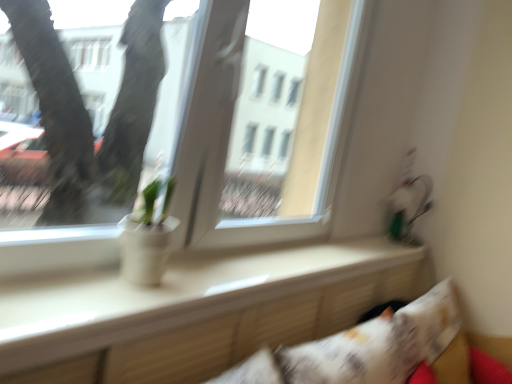
Image resolution: width=512 pixels, height=384 pixels. Describe the element at coordinates (196, 312) in the screenshot. I see `white glossy window sill at center` at that location.

Find the location of a particular element. This screenshot has width=512, height=384. white matte pot at center is located at coordinates (148, 237).

The height and width of the screenshot is (384, 512). I want to click on white printed pillow at lower right, so click(x=378, y=344).

Is white printed pillow at lower right not close to transparent glass window at center?

That's not correct — white printed pillow at lower right is a little close to transparent glass window at center.

Consider the image. Between white printed pillow at lower right and transparent glass window at center, which one has more height?

Standing taller between the two is transparent glass window at center.

From a real-world perspective, is white printed pillow at lower right on top of transparent glass window at center?

Incorrect, from a real-world perspective, white printed pillow at lower right is lower than transparent glass window at center.

Does white glossy window sill at center lie behind transparent glass window at center?

No, it is not.

Between white glossy window sill at center and transparent glass window at center, which one has more height?

Standing taller between the two is transparent glass window at center.

Considering the sizes of objects white glossy window sill at center and transparent glass window at center in the image provided, who is smaller, white glossy window sill at center or transparent glass window at center?

With smaller size is white glossy window sill at center.

Would you say white glossy window sill at center is to the left or to the right of transparent glass window at center in the picture?

In the image, white glossy window sill at center appears on the right side of transparent glass window at center.

Is transparent glass window at center closer to the viewer compared to white printed pillow at lower right?

No, it is behind white printed pillow at lower right.

Is transparent glass window at center located outside white printed pillow at lower right?

Absolutely, transparent glass window at center is external to white printed pillow at lower right.

From the image's perspective, which one is positioned higher, transparent glass window at center or white printed pillow at lower right?

transparent glass window at center.

Can you tell me how much transparent glass window at center and white printed pillow at lower right differ in facing direction?

The angle between the facing direction of transparent glass window at center and the facing direction of white printed pillow at lower right is 0.831 degrees.

From a real-world perspective, is white matte pot at center positioned under white printed pillow at lower right based on gravity?

Incorrect, from a real-world perspective, white matte pot at center is higher than white printed pillow at lower right.

Which of these two, white matte pot at center or white printed pillow at lower right, is smaller?

white matte pot at center.

Considering the positions of objects white matte pot at center and white printed pillow at lower right in the image provided, who is more to the right, white matte pot at center or white printed pillow at lower right?

From the viewer's perspective, white printed pillow at lower right appears more on the right side.

What are the coordinates of `pillow that is behind the white matte pot at center` in the screenshot? It's located at (378, 344).

The image size is (512, 384). In order to click on houseplant that appears in front of the transparent glass window at center in this screenshot , I will do `click(148, 237)`.

Does white matte pot at center turn towards transparent glass window at center?

No.

Would you say transparent glass window at center is part of white matte pot at center's contents?

Definitely not — transparent glass window at center is not inside white matte pot at center.

Is white matte pot at center bigger than transparent glass window at center?

Actually, white matte pot at center might be smaller than transparent glass window at center.

From the image's perspective, is white glossy window sill at center positioned above or below white matte pot at center?

white glossy window sill at center is situated lower than white matte pot at center in the image.

Does white glossy window sill at center turn towards white matte pot at center?

No, white glossy window sill at center does not turn towards white matte pot at center.

How many degrees apart are the facing directions of white glossy window sill at center and white matte pot at center?

0.265 degrees separate the facing orientations of white glossy window sill at center and white matte pot at center.

Between white matte pot at center and white glossy window sill at center, which one appears on the right side from the viewer's perspective?

white glossy window sill at center.

Who is more distant, white matte pot at center or white glossy window sill at center?

white matte pot at center is more distant.

Between white matte pot at center and white glossy window sill at center, which one has more height?

white matte pot at center is taller.

At what (x,y) coordinates should I click in order to perform the action: click on pillow in front of the transparent glass window at center. Please return your answer as a coordinate pair (x, y). Looking at the image, I should click on (378, 344).

Find the location of `window sill that is on the right side of transparent glass window at center`. window sill that is on the right side of transparent glass window at center is located at coordinates (196, 312).

Looking at the image, which one is located further to white matte pot at center, white printed pillow at lower right or white glossy window sill at center?

Based on the image, white printed pillow at lower right appears to be further to white matte pot at center.

Based on their spatial positions, is white matte pot at center or white glossy window sill at center closer to transparent glass window at center?

white matte pot at center.

From the image, which object appears to be nearer to white glossy window sill at center, transparent glass window at center or white printed pillow at lower right?

white printed pillow at lower right lies closer to white glossy window sill at center than the other object.

From the image, which object appears to be farther from white printed pillow at lower right, white matte pot at center or transparent glass window at center?

Among the two, white matte pot at center is located further to white printed pillow at lower right.

Looking at the image, which one is located further to white printed pillow at lower right, white matte pot at center or white glossy window sill at center?

Based on the image, white matte pot at center appears to be further to white printed pillow at lower right.

Which object lies nearer to the anchor point white glossy window sill at center, white printed pillow at lower right or white matte pot at center?

white printed pillow at lower right is closer to white glossy window sill at center.

In the scene shown: When comparing their distances from white glossy window sill at center, does transparent glass window at center or white matte pot at center seem closer?

white matte pot at center is closer to white glossy window sill at center.

From the image, which object appears to be nearer to white matte pot at center, white glossy window sill at center or white printed pillow at lower right?

Based on the image, white glossy window sill at center appears to be nearer to white matte pot at center.

The image size is (512, 384). Identify the location of window sill between white matte pot at center and white printed pillow at lower right in the horizontal direction. (196, 312).

At what (x,y) coordinates should I click in order to perform the action: click on houseplant between transparent glass window at center and white printed pillow at lower right in the vertical direction. Please return your answer as a coordinate pair (x, y). The width and height of the screenshot is (512, 384). Looking at the image, I should click on (148, 237).

Identify the location of window sill between transparent glass window at center and white printed pillow at lower right vertically. (196, 312).

Find the location of a particular element. The height and width of the screenshot is (384, 512). houseplant between transparent glass window at center and white glossy window sill at center from top to bottom is located at coordinates (148, 237).